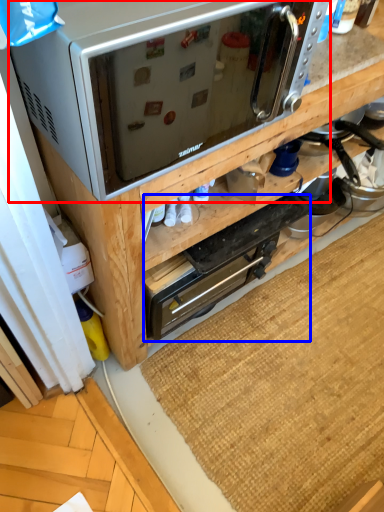
Question: Which point is closer to the camera, microwave oven (highlighted by a red box) or appliance (highlighted by a blue box)?

Choices:
 (A) microwave oven
 (B) appliance

Answer: (A)